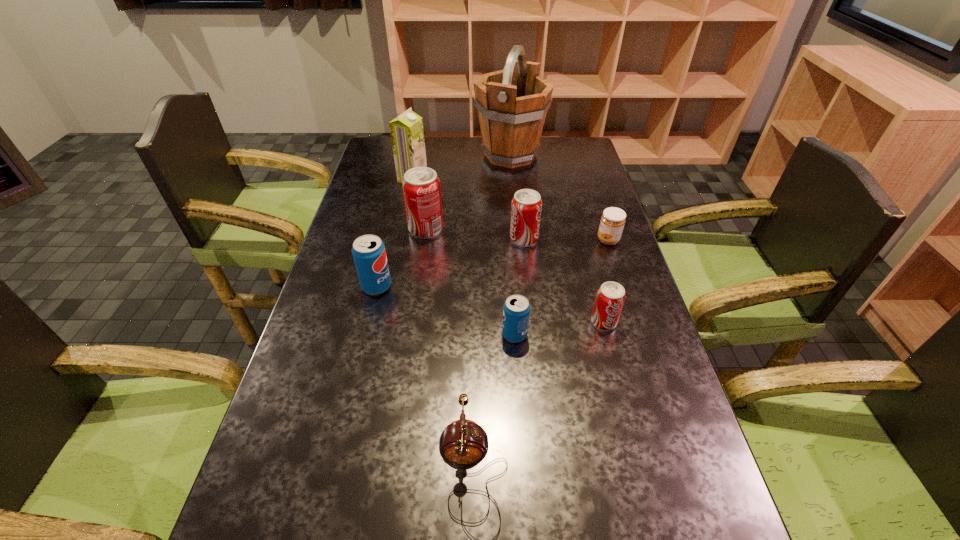
Where is `the tallest object`? the tallest object is located at coordinates (512, 103).

Find the location of a particular element. the eighth shortest object is located at coordinates (407, 134).

In order to click on green soya milk in this screenshot , I will do `click(407, 134)`.

Locate an element on the screen. Image resolution: width=960 pixels, height=540 pixels. the tallest soda can is located at coordinates (421, 186).

Image resolution: width=960 pixels, height=540 pixels. Identify the location of the leftmost red soda can. (421, 186).

This screenshot has height=540, width=960. I want to click on the second biggest red soda can, so click(x=526, y=206).

This screenshot has height=540, width=960. Find the location of `the farther blue soda can`. the farther blue soda can is located at coordinates click(368, 251).

You are a GUI agent. You are given a task and a screenshot of the screen. Output one action in this format:
    pyautogui.click(x=<x>, y=<y>)
    Task: Click on the left blue soda can
    The width and height of the screenshot is (960, 540).
    Given the screenshot: What is the action you would take?
    pyautogui.click(x=368, y=251)

This screenshot has width=960, height=540. I want to click on the smallest red soda can, so (x=610, y=297).

Identify the location of the second object from right to left. This screenshot has width=960, height=540. (610, 297).